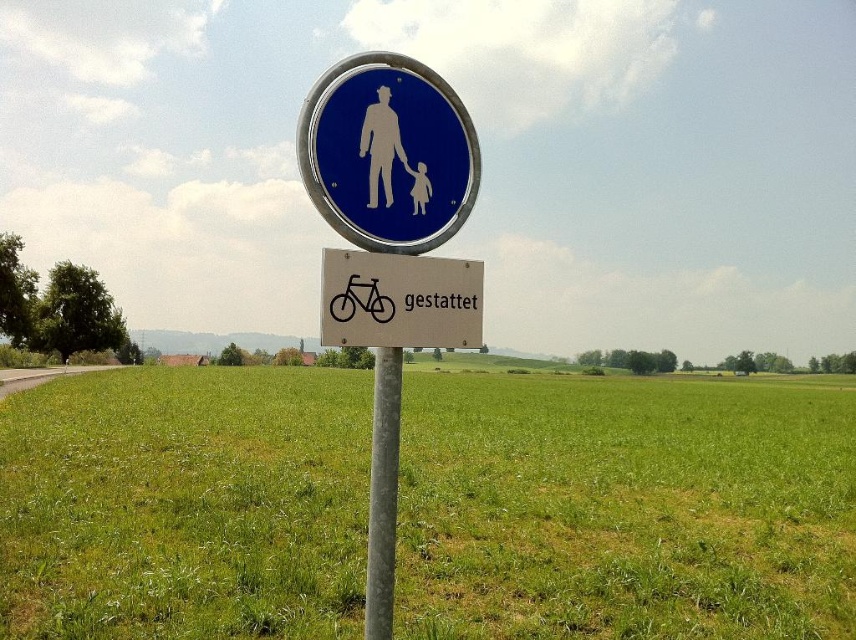
Does white plastic bicycle at center appear on the right side of white matte figure at upper center?

Indeed, white plastic bicycle at center is positioned on the right side of white matte figure at upper center.

Does white plastic bicycle at center have a greater height compared to white matte figure at upper center?

In fact, white plastic bicycle at center may be shorter than white matte figure at upper center.

Locate an element on the screen. The height and width of the screenshot is (640, 856). white plastic bicycle at center is located at coordinates (399, 300).

Who is positioned more to the left, white plastic bicycle at center or metallic pole at center?

metallic pole at center is more to the left.

Which is below, white plastic bicycle at center or metallic pole at center?

Positioned lower is metallic pole at center.

Measure the distance between white plastic bicycle at center and camera.

white plastic bicycle at center and camera are 2.89 meters apart.

Locate an element on the screen. This screenshot has width=856, height=640. white plastic bicycle at center is located at coordinates (399, 300).

Is point (357, 230) closer to viewer compared to point (363, 156)?

That is True.

Which is above, blue glossy sign at upper center or white matte figure at upper center?

blue glossy sign at upper center

Is point (437, 122) farther from viewer compared to point (379, 120)?

Yes, point (437, 122) is farther from viewer.

What are the coordinates of `blue glossy sign at upper center` in the screenshot? It's located at (387, 154).